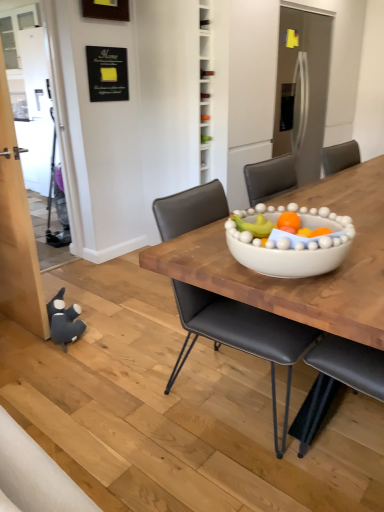
Question: Considering the positions of dark gray plush toy at lower left and black leather chair at center in the image, is dark gray plush toy at lower left bigger or smaller than black leather chair at center?

Choices:
 (A) big
 (B) small

Answer: (B)

Question: In terms of height, does dark gray plush toy at lower left look taller or shorter compared to black leather chair at center?

Choices:
 (A) tall
 (B) short

Answer: (B)

Question: From the image's perspective, is dark gray plush toy at lower left located above or below black leather chair at center?

Choices:
 (A) below
 (B) above

Answer: (A)

Question: Considering the positions of point (226, 323) and point (82, 327), is point (226, 323) closer or farther from the camera than point (82, 327)?

Choices:
 (A) farther
 (B) closer

Answer: (B)

Question: Is black leather chair at center taller or shorter than dark gray plush toy at lower left?

Choices:
 (A) short
 (B) tall

Answer: (B)

Question: Do you think black leather chair at center is within dark gray plush toy at lower left, or outside of it?

Choices:
 (A) outside
 (B) inside

Answer: (A)

Question: Considering their positions, is black leather chair at center located in front of or behind dark gray plush toy at lower left?

Choices:
 (A) front
 (B) behind

Answer: (A)